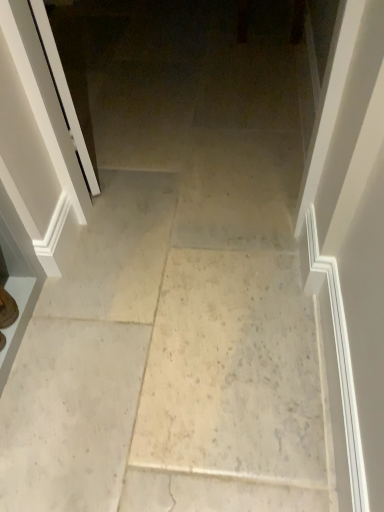
Question: Does matte brown shoe at lower left have a greater height compared to white glossy screen door at left?

Choices:
 (A) no
 (B) yes

Answer: (A)

Question: Is matte brown shoe at lower left positioned in front of white glossy screen door at left?

Choices:
 (A) yes
 (B) no

Answer: (B)

Question: Is matte brown shoe at lower left looking in the opposite direction of white glossy screen door at left?

Choices:
 (A) yes
 (B) no

Answer: (B)

Question: Is white glossy screen door at left completely or partially inside matte brown shoe at lower left?

Choices:
 (A) no
 (B) yes

Answer: (A)

Question: From a real-world perspective, is matte brown shoe at lower left on white glossy screen door at left?

Choices:
 (A) no
 (B) yes

Answer: (A)

Question: Does matte brown shoe at lower left turn towards white glossy screen door at left?

Choices:
 (A) no
 (B) yes

Answer: (A)

Question: Does white glossy screen door at left touch matte brown shoe at lower left?

Choices:
 (A) yes
 (B) no

Answer: (B)

Question: Is white glossy screen door at left oriented away from matte brown shoe at lower left?

Choices:
 (A) yes
 (B) no

Answer: (B)

Question: Is white glossy screen door at left aimed at matte brown shoe at lower left?

Choices:
 (A) yes
 (B) no

Answer: (B)

Question: Considering the relative sizes of white glossy screen door at left and matte brown shoe at lower left in the image provided, is white glossy screen door at left smaller than matte brown shoe at lower left?

Choices:
 (A) no
 (B) yes

Answer: (A)

Question: Does white glossy screen door at left have a larger size compared to matte brown shoe at lower left?

Choices:
 (A) no
 (B) yes

Answer: (B)

Question: Is white glossy screen door at left not close to matte brown shoe at lower left?

Choices:
 (A) yes
 (B) no

Answer: (B)

Question: From the image's perspective, is white glossy screen door at left located beneath white marble floor at center?

Choices:
 (A) yes
 (B) no

Answer: (B)